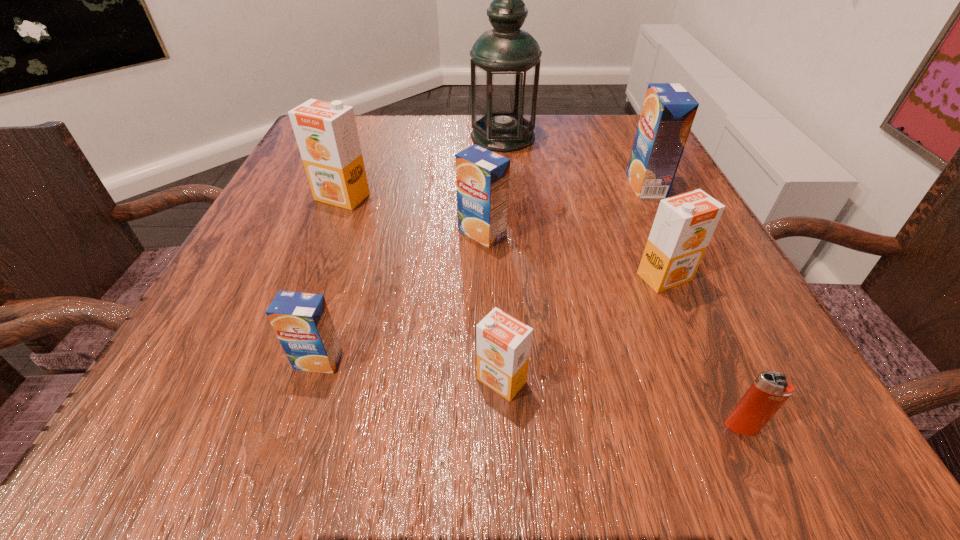
Where is `free space at the left edge`? This screenshot has height=540, width=960. free space at the left edge is located at coordinates (268, 237).

What are the coordinates of `vacant space at the right edge of the desktop` in the screenshot? It's located at (712, 268).

This screenshot has height=540, width=960. Identify the location of free point at the far left corner. (355, 121).

At what (x,y) coordinates should I click in order to perform the action: click on vacant space at the far right corner. Please return your answer as a coordinate pair (x, y). Looking at the image, I should click on (598, 156).

Locate an element on the screen. This screenshot has height=540, width=960. free area in between the fifth nearest object and the biggest blue orange_juice is located at coordinates (564, 210).

Locate an element on the screen. This screenshot has width=960, height=540. vacant point located between the nearest blue orange_juice and the nearest orange orange juice is located at coordinates (410, 370).

At what (x,y) coordinates should I click in order to perform the action: click on empty location between the farthest blue orange_juice and the second blue orange_juice from right to left. Please return your answer as a coordinate pair (x, y). Looking at the image, I should click on (564, 210).

I want to click on vacant point located between the leftmost blue orange_juice and the oil lamp, so click(x=411, y=249).

I want to click on vacant area between the nearest orange orange juice and the nearest object, so click(x=621, y=404).

Find the location of a particular element. The width and height of the screenshot is (960, 540). free point between the smallest orange orange juice and the igniter is located at coordinates (621, 404).